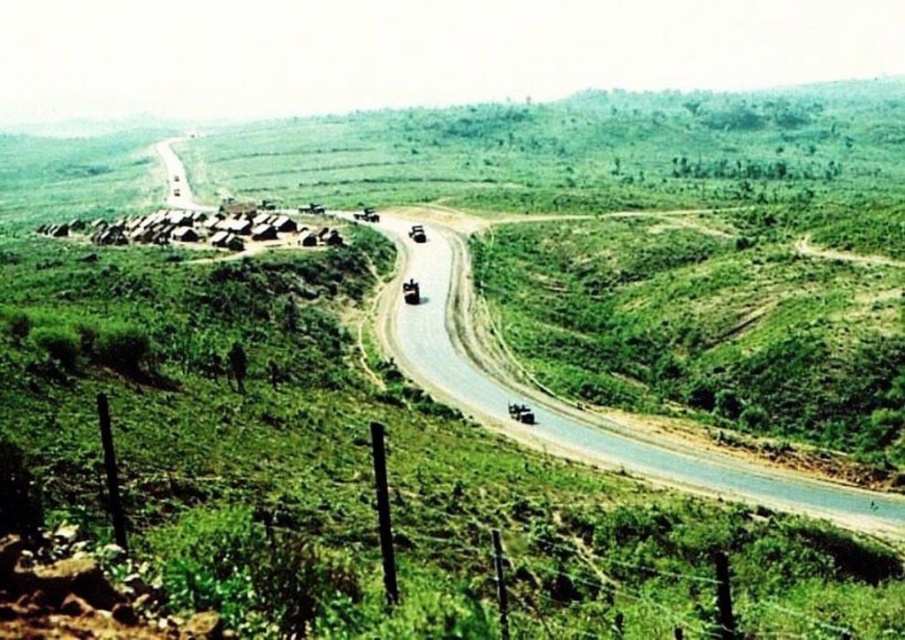
Based on the photo, you are a delivery driver navigating a rural area and see the asphalt road at center and the asphalt road at upper left. Which road segment is closer to you as you drive along the winding path?

The asphalt road at center is closer to you because it is in front of the asphalt road at upper left, meaning the one at center is nearer to your current position.

You are a delivery driver navigating through a rural area. You see the asphalt road at center and the asphalt road at upper left. Which road is narrower?

The asphalt road at center is thinner than asphalt road at upper left, so the asphalt road at center is narrower.

You are a delivery driver planning to drive from the asphalt road at center to the asphalt road at upper left. According to the map, the distance between them is 215.27 meters. If your vehicle can only travel 200 meters before needing to refuel, what should you do?

The asphalt road at center and asphalt road at upper left are 215.27 meters apart. Since your vehicle can only travel 200 meters before needing to refuel, you will need to refuel before reaching the asphalt road at upper left to ensure you have enough fuel for the journey.